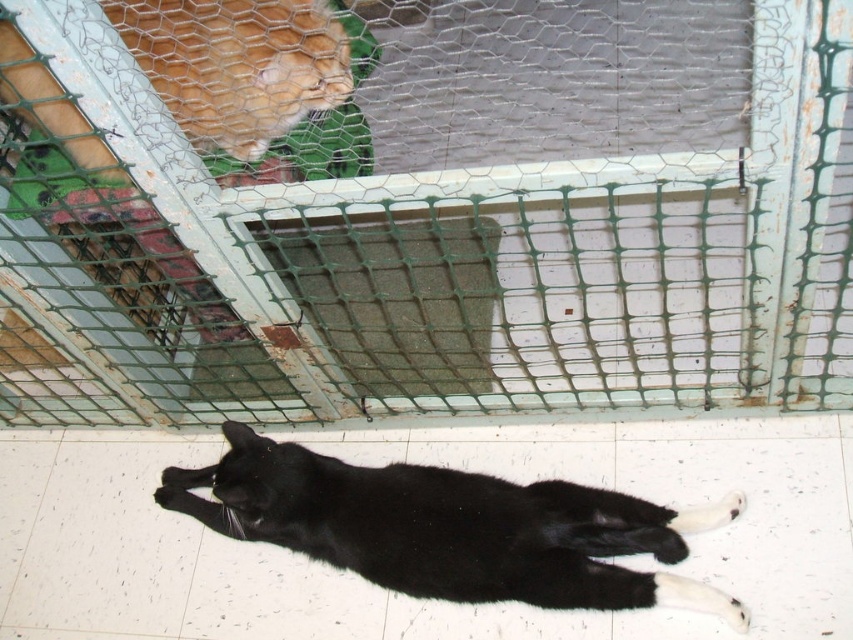
Consider the image. Who is more forward, (659,388) or (117,20)?

Point (117,20) is more forward.

Between green wire mesh at upper center and orange fur cat at upper left, which one is positioned higher?

Positioned higher is green wire mesh at upper center.

Locate an element on the screen. This screenshot has height=640, width=853. green wire mesh at upper center is located at coordinates (424, 209).

The height and width of the screenshot is (640, 853). I want to click on green wire mesh at upper center, so click(424, 209).

Is black fur cat at lower center bigger than orange fur cat at upper left?

Actually, black fur cat at lower center might be smaller than orange fur cat at upper left.

Between black fur cat at lower center and orange fur cat at upper left, which one has less height?

black fur cat at lower center is shorter.

Where is `black fur cat at lower center`? The height and width of the screenshot is (640, 853). black fur cat at lower center is located at coordinates tap(450, 529).

In the scene shown: Can you confirm if green wire mesh at upper center is positioned to the left of black fur cat at lower center?

In fact, green wire mesh at upper center is to the right of black fur cat at lower center.

What do you see at coordinates (424, 209) in the screenshot?
I see `green wire mesh at upper center` at bounding box center [424, 209].

Locate an element on the screen. This screenshot has height=640, width=853. green wire mesh at upper center is located at coordinates (424, 209).